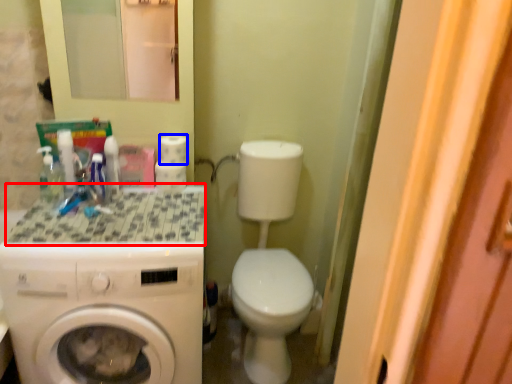
Question: Which object is closer to the camera taking this photo, counter top (highlighted by a red box) or toilet paper (highlighted by a blue box)?

Choices:
 (A) counter top
 (B) toilet paper

Answer: (A)